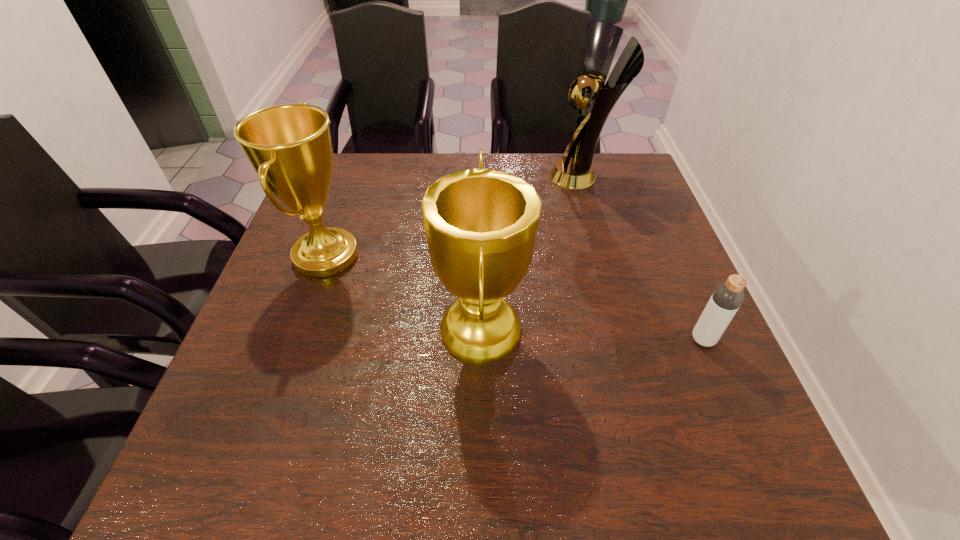
This screenshot has height=540, width=960. I want to click on the rightmost award, so click(x=595, y=99).

The width and height of the screenshot is (960, 540). I want to click on the farthest object, so click(595, 99).

You are a GUI agent. You are given a task and a screenshot of the screen. Output one action in this format:
    pyautogui.click(x=<x>, y=<y>)
    Task: Click on the leftmost object
    The height and width of the screenshot is (540, 960).
    Given the screenshot: What is the action you would take?
    pyautogui.click(x=289, y=146)

What are the coordinates of `the second award from right to left` in the screenshot? It's located at (480, 224).

This screenshot has height=540, width=960. What are the coordinates of `the shortest object` in the screenshot? It's located at (726, 299).

Where is `bottle`? bottle is located at coordinates (726, 299).

Where is `free spot located 0.190m at the front of the third object from left to right, where the globe is visible`? free spot located 0.190m at the front of the third object from left to right, where the globe is visible is located at coordinates (484, 176).

The image size is (960, 540). I want to click on vacant area situated at the front of the third object from left to right, where the globe is visible, so click(516, 176).

The width and height of the screenshot is (960, 540). I want to click on vacant space located at the front of the third object from left to right, where the globe is visible, so click(444, 176).

In order to click on free space located 0.350m by the handles of the leftmost award in this screenshot , I will do `click(510, 256)`.